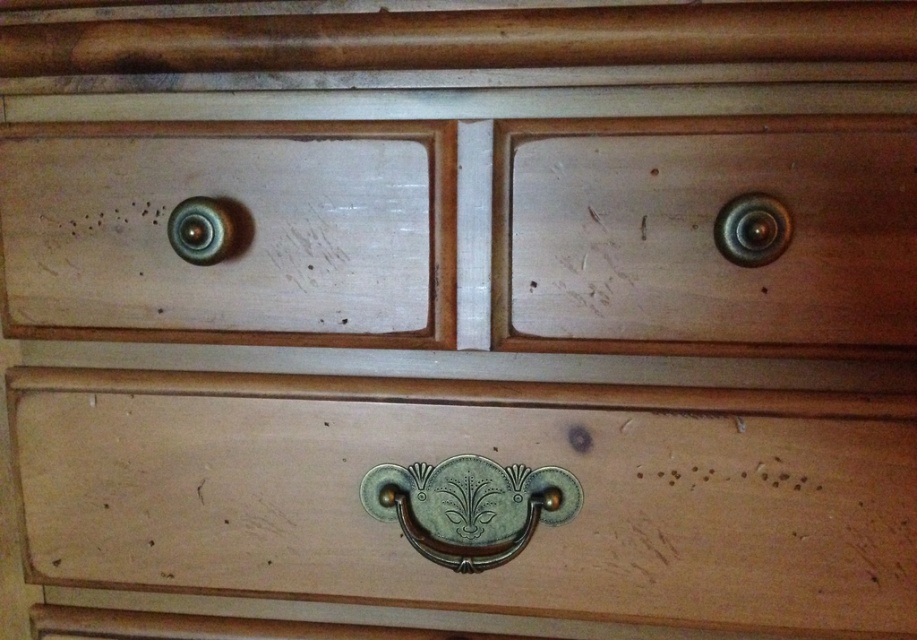
Question: Does matte wood drawer at left have a smaller size compared to metallic brass knob at upper left?

Choices:
 (A) no
 (B) yes

Answer: (A)

Question: Which object is farther from the camera taking this photo?

Choices:
 (A) metallic gold knob at upper right
 (B) matte wood drawer at left

Answer: (B)

Question: Which is farther from the metallic gold knob at upper right?

Choices:
 (A) matte wood drawer at bottom
 (B) metallic brass knob at upper left

Answer: (B)

Question: Based on their relative distances, which object is farther from the metallic gold knob at upper right?

Choices:
 (A) matte wood drawer at bottom
 (B) matte wood drawer at left

Answer: (B)

Question: Is matte wood drawer at bottom behind metallic gold knob at upper right?

Choices:
 (A) yes
 (B) no

Answer: (A)

Question: Does light wood drawer at right have a larger size compared to metallic gold knob at upper right?

Choices:
 (A) no
 (B) yes

Answer: (B)